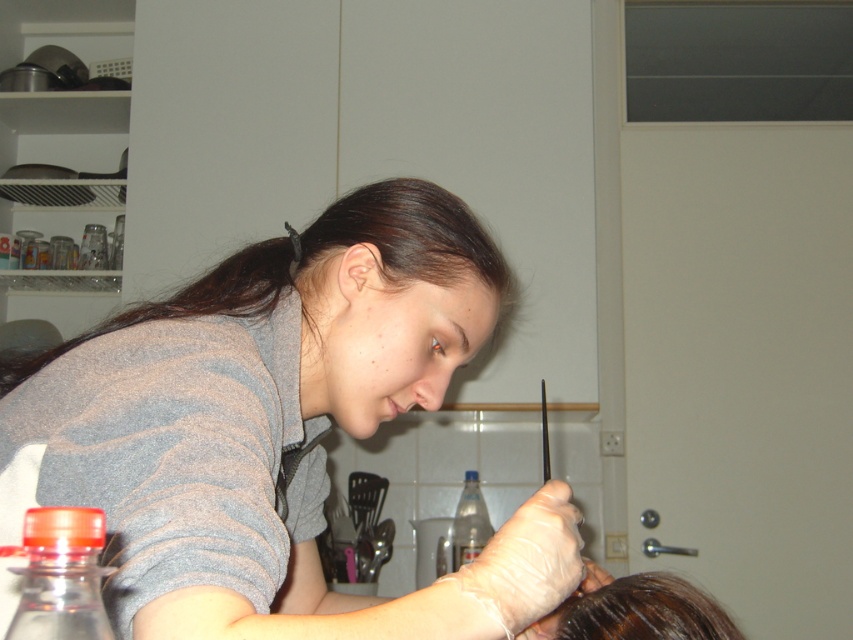
Question: Which of the following is the farthest from the observer?

Choices:
 (A) gray matte shirt at upper left
 (B) transparent plastic bottle at lower left

Answer: (A)

Question: Which object is the farthest from the transparent plastic bottle at lower left?

Choices:
 (A) translucent plastic bottle at center
 (B) gray matte shirt at upper left

Answer: (A)

Question: Can you confirm if gray matte shirt at upper left is positioned below translucent plastic bottle at center?

Choices:
 (A) no
 (B) yes

Answer: (A)

Question: Is transparent plastic bottle at lower left in front of translucent plastic bottle at center?

Choices:
 (A) yes
 (B) no

Answer: (A)

Question: Which object is positioned farthest from the translucent plastic bottle at center?

Choices:
 (A) gray matte shirt at upper left
 (B) transparent plastic bottle at lower left

Answer: (B)

Question: In this image, where is gray matte shirt at upper left located relative to translucent plastic bottle at center?

Choices:
 (A) below
 (B) above

Answer: (B)